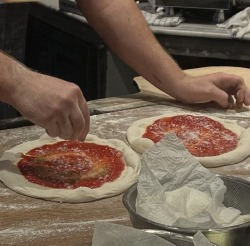
At what (x,y) coordinates should I click in order to perform the action: click on tabletop. Please return your answer as a coordinate pair (x, y). This screenshot has width=250, height=246. Looking at the image, I should click on (107, 124), (197, 30).